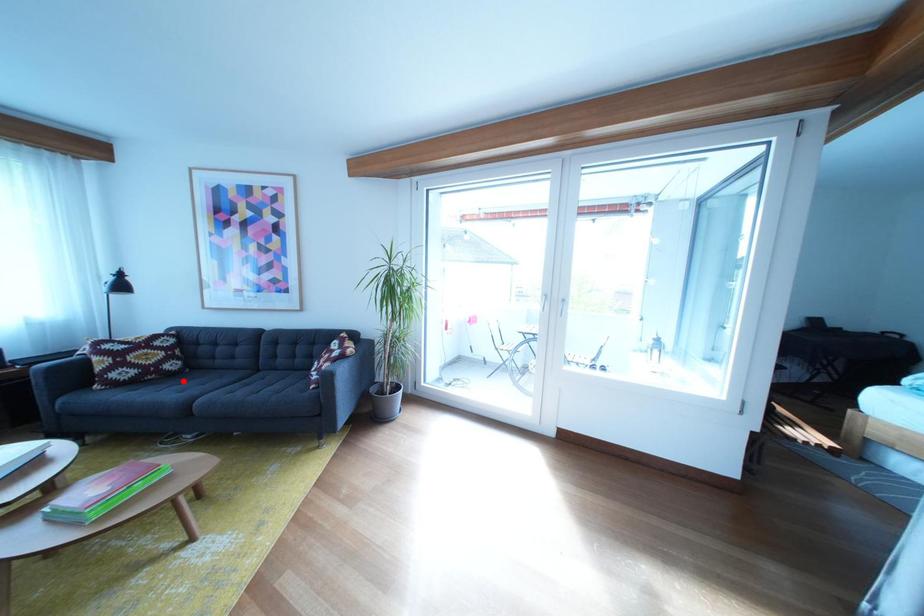
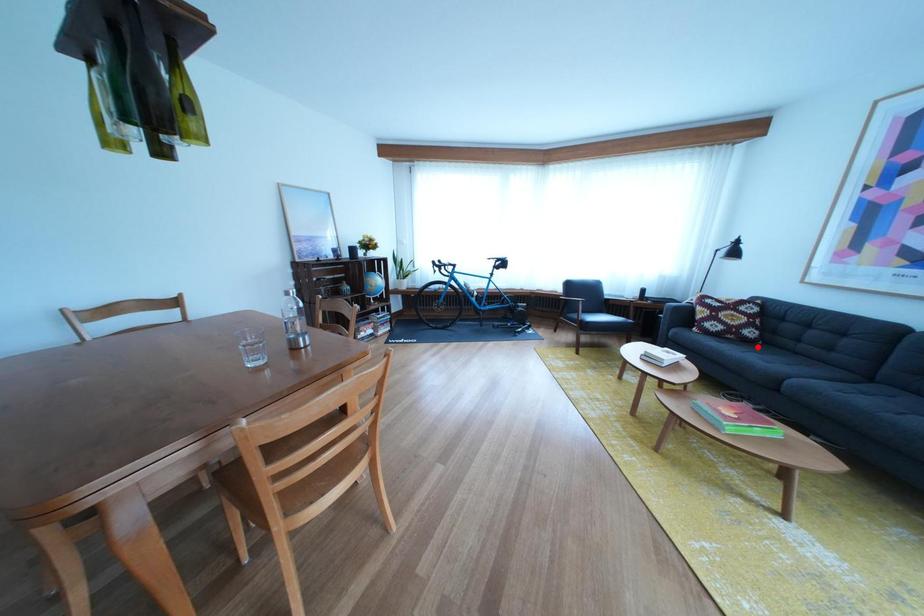
I am providing you with two images of the same scene from different viewpoints. A red point is marked on the first image and another point is marked on the second image. Are the points marked in image1 and image2 representing the same 3D position?

Yes